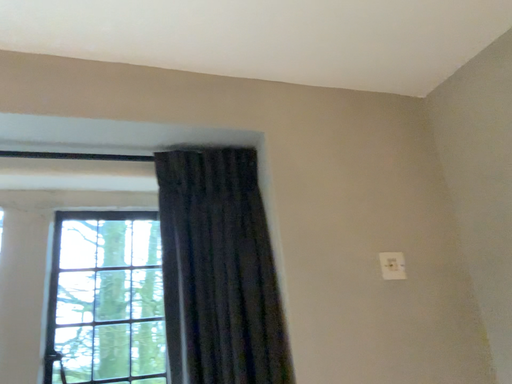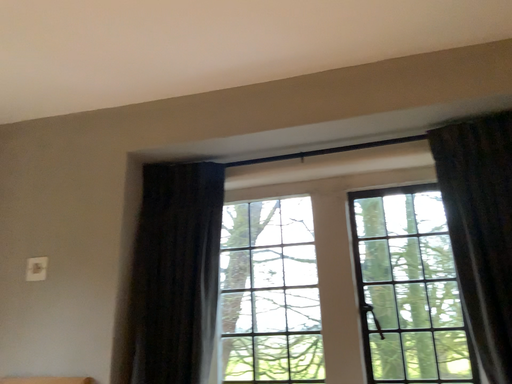
Question: Which way did the camera rotate in the video?

Choices:
 (A) rotated downward
 (B) rotated upward

Answer: (A)